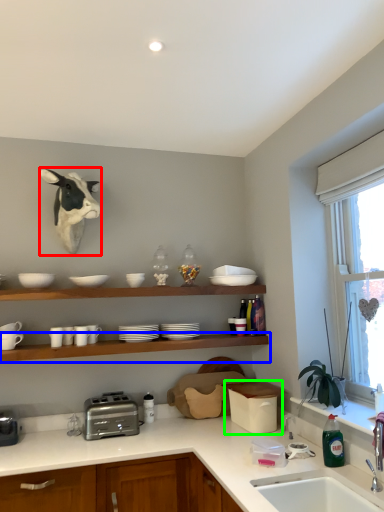
Question: Considering the real-world distances, which object is closest to cattle (highlighted by a red box)? shelve (highlighted by a blue box) or appliance (highlighted by a green box).

Choices:
 (A) shelve
 (B) appliance

Answer: (A)